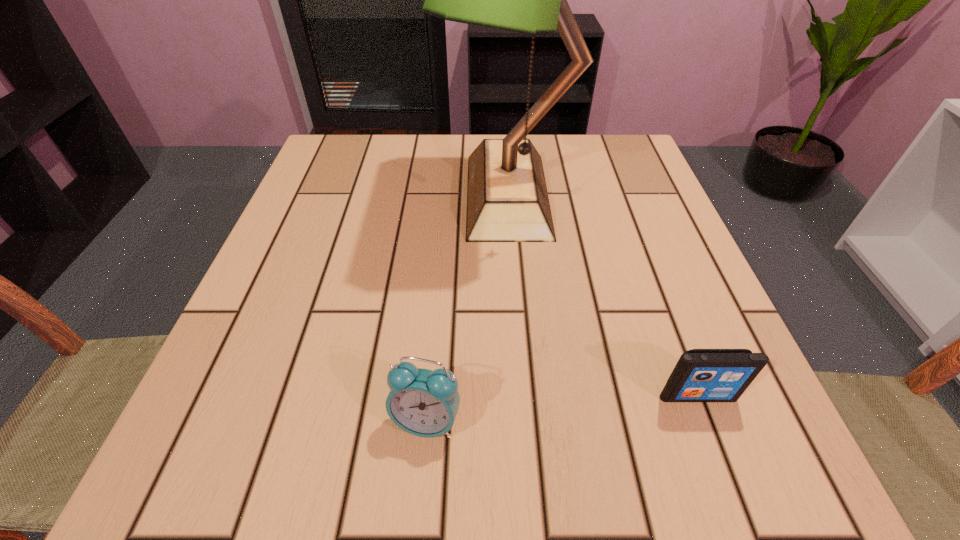
Find the location of a particular element. The width and height of the screenshot is (960, 540). vacant space that's between the table lamp and the rightmost object is located at coordinates (603, 295).

Where is `empty space that is in between the second tallest object and the iPod`? Image resolution: width=960 pixels, height=540 pixels. empty space that is in between the second tallest object and the iPod is located at coordinates (562, 408).

Image resolution: width=960 pixels, height=540 pixels. Find the location of `empty space between the alarm clock and the table lamp`. empty space between the alarm clock and the table lamp is located at coordinates (468, 308).

Locate an element on the screen. The height and width of the screenshot is (540, 960). free spot between the shortest object and the second shortest object is located at coordinates (562, 408).

What are the coordinates of `empty space between the farthest object and the rightmost object` in the screenshot? It's located at click(603, 295).

Where is `vacant area between the shortest object and the second shortest object`? The height and width of the screenshot is (540, 960). vacant area between the shortest object and the second shortest object is located at coordinates (562, 408).

Where is `vacant area that lies between the tallest object and the second shortest object`? vacant area that lies between the tallest object and the second shortest object is located at coordinates (468, 308).

You are a GUI agent. You are given a task and a screenshot of the screen. Output one action in this format:
    pyautogui.click(x=<x>, y=<y>)
    Task: Click on the vacant area that lies between the alarm clock and the tallest object
    
    Given the screenshot: What is the action you would take?
    pyautogui.click(x=468, y=308)

Find the location of a particular element. Image resolution: width=960 pixels, height=540 pixels. the second closest object to the shortest object is located at coordinates (507, 200).

Identify which object is the second nearest to the farthest object. Please provide its 2D coordinates. Your answer should be formatted as a tuple, i.e. [(x, y)], where the tuple contains the x and y coordinates of a point satisfying the conditions above.

[(422, 402)]